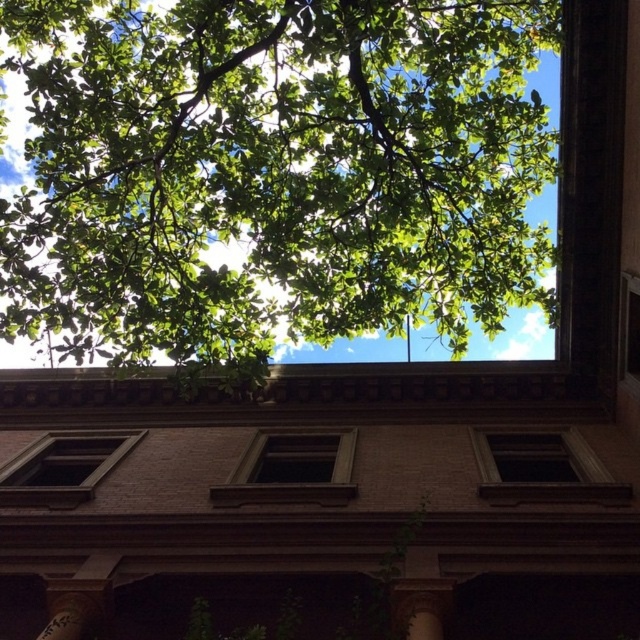
You are standing below the building and looking up. You want to know if the green leafy tree at upper center is blocking the view of the brown wooden window at center. Based on their positions, can you determine if the tree is above or below the window?

The green leafy tree at upper center is located above the brown wooden window at center, so it is blocking the view of the window.

You are standing directly below the building facade shown in the image. You want to know the exact location of the green leafy tree at upper center. What are its coordinates?

The green leafy tree at upper center is located at coordinates point (273, 172).